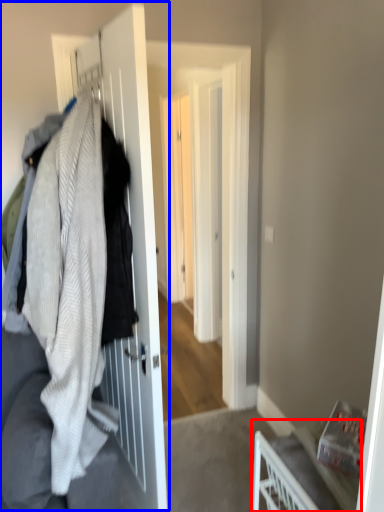
Question: Which point is closer to the camera, furniture (highlighted by a red box) or closet (highlighted by a blue box)?

Choices:
 (A) furniture
 (B) closet

Answer: (B)